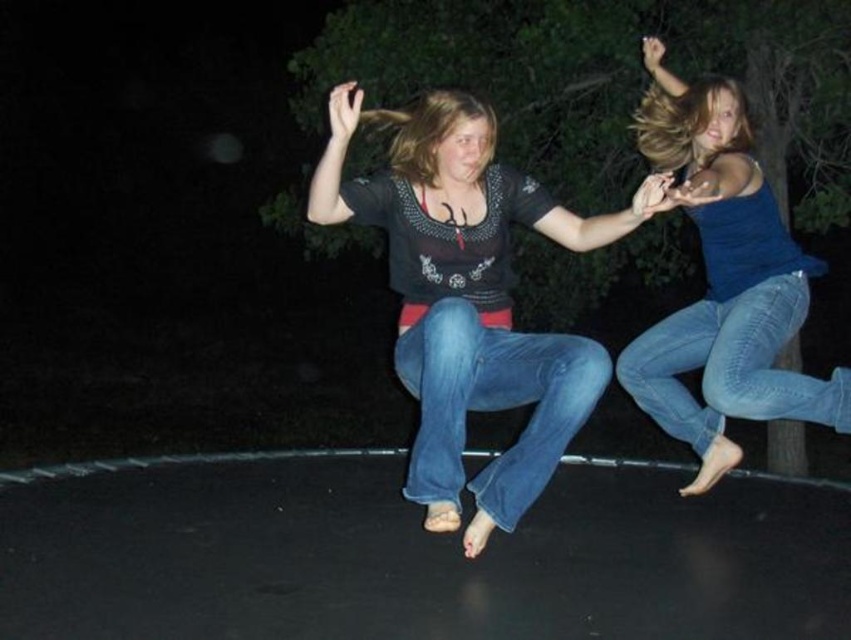
Is matte black shirt at center to the right of denim jeans at right from the viewer's perspective?

In fact, matte black shirt at center is to the left of denim jeans at right.

In the scene shown: Does matte black shirt at center appear over denim jeans at right?

Indeed, matte black shirt at center is positioned over denim jeans at right.

Does point (441, 412) lie in front of point (634, 353)?

Yes, point (441, 412) is closer to viewer.

Image resolution: width=851 pixels, height=640 pixels. Identify the location of matte black shirt at center. click(x=467, y=298).

Between matte black shirt at center and blue denim jeans at center, which one is positioned lower?

Positioned lower is blue denim jeans at center.

Who is higher up, matte black shirt at center or blue denim jeans at center?

Positioned higher is matte black shirt at center.

Image resolution: width=851 pixels, height=640 pixels. Describe the element at coordinates (467, 298) in the screenshot. I see `matte black shirt at center` at that location.

You are a GUI agent. You are given a task and a screenshot of the screen. Output one action in this format:
    pyautogui.click(x=<x>, y=<y>)
    Task: Click on the matte black shirt at center
    This screenshot has width=851, height=640.
    Given the screenshot: What is the action you would take?
    pyautogui.click(x=467, y=298)

Can you confirm if blue denim jeans at center is bigger than denim jeans at right?

Actually, blue denim jeans at center might be smaller than denim jeans at right.

What do you see at coordinates (492, 403) in the screenshot? This screenshot has height=640, width=851. I see `blue denim jeans at center` at bounding box center [492, 403].

Where is `blue denim jeans at center`? blue denim jeans at center is located at coordinates (492, 403).